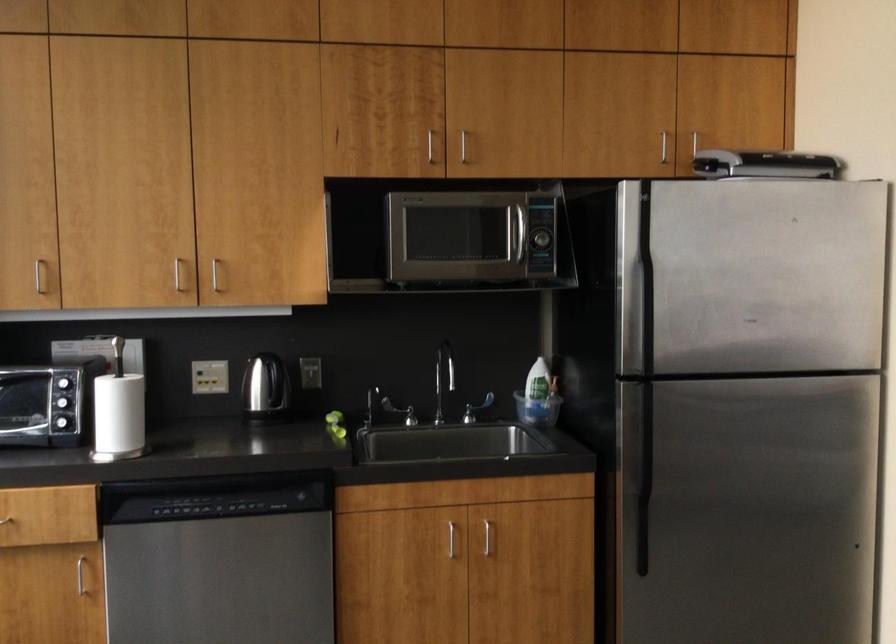
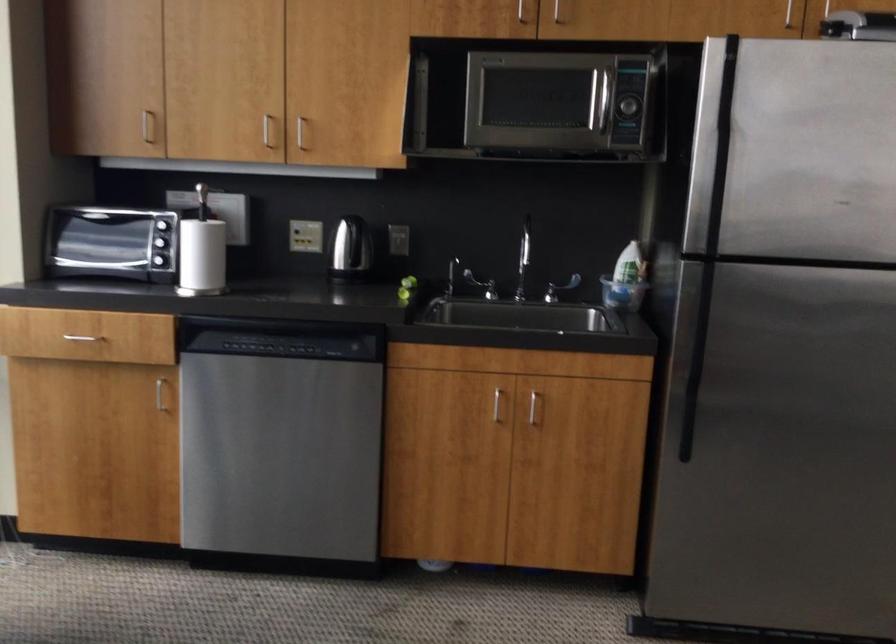
Find the pixel in the second image that matches [540,239] in the first image.

(626, 106)